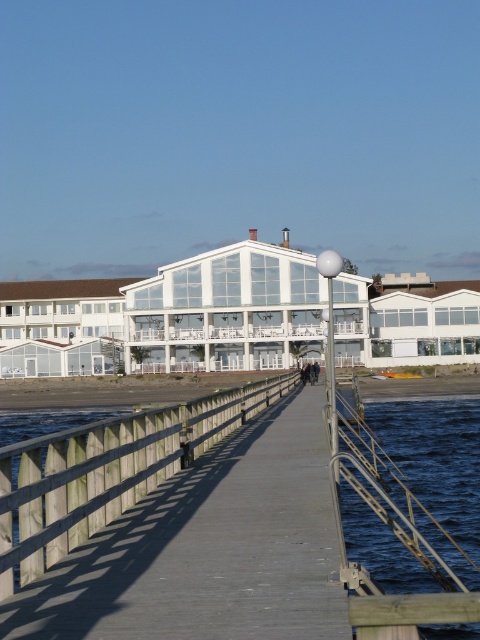
Can you confirm if wooden at center is taller than blue water at lower right?

No.

The height and width of the screenshot is (640, 480). I want to click on wooden at center, so click(107, 472).

What do you see at coordinates (107, 472) in the screenshot? I see `wooden at center` at bounding box center [107, 472].

The height and width of the screenshot is (640, 480). I want to click on wooden at center, so click(x=107, y=472).

Describe the element at coordinates (107, 472) in the screenshot. Image resolution: width=480 pixels, height=640 pixels. I see `wooden at center` at that location.

Which is above, wooden at center or dark blue jeans at center?

wooden at center

Who is more distant from viewer, (91, 484) or (303, 380)?

Positioned behind is point (303, 380).

Find the location of a particular element. wooden at center is located at coordinates (107, 472).

Is blue water at lower right above dark blue jeans at center?

Incorrect, blue water at lower right is not positioned above dark blue jeans at center.

In the scene shown: Who is positioned more to the right, blue water at lower right or dark blue jeans at center?

blue water at lower right

The height and width of the screenshot is (640, 480). Find the location of `blue water at lower right`. blue water at lower right is located at coordinates pos(424,468).

Image resolution: width=480 pixels, height=640 pixels. In order to click on blue water at lower right in this screenshot , I will do `click(424, 468)`.